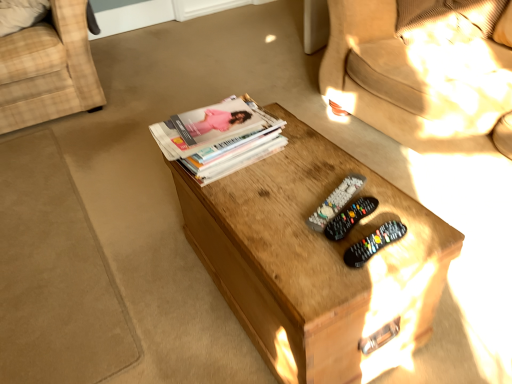
The image size is (512, 384). I want to click on vacant space in between black plastic remote control at center, marked as the second remote control in a back-to-front arrangement, and white glossy magazine stack at center, so click(274, 179).